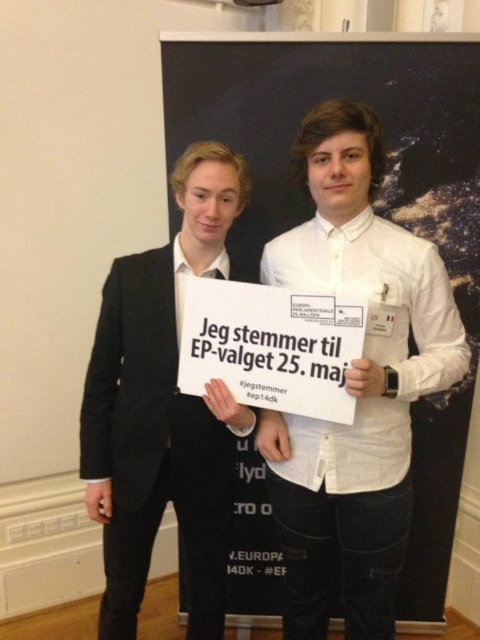
Question: Which object appears closest to the camera in this image?

Choices:
 (A) white cotton shirt at center
 (B) black matte suit at center

Answer: (A)

Question: Is white cotton shirt at center closer to the viewer compared to black matte suit at center?

Choices:
 (A) yes
 (B) no

Answer: (A)

Question: Which object appears farthest from the camera in this image?

Choices:
 (A) black matte suit at center
 (B) white cotton shirt at center

Answer: (A)

Question: In this image, where is white cotton shirt at center located relative to black matte suit at center?

Choices:
 (A) below
 (B) above

Answer: (B)

Question: Does white cotton shirt at center have a larger size compared to black matte suit at center?

Choices:
 (A) yes
 (B) no

Answer: (A)